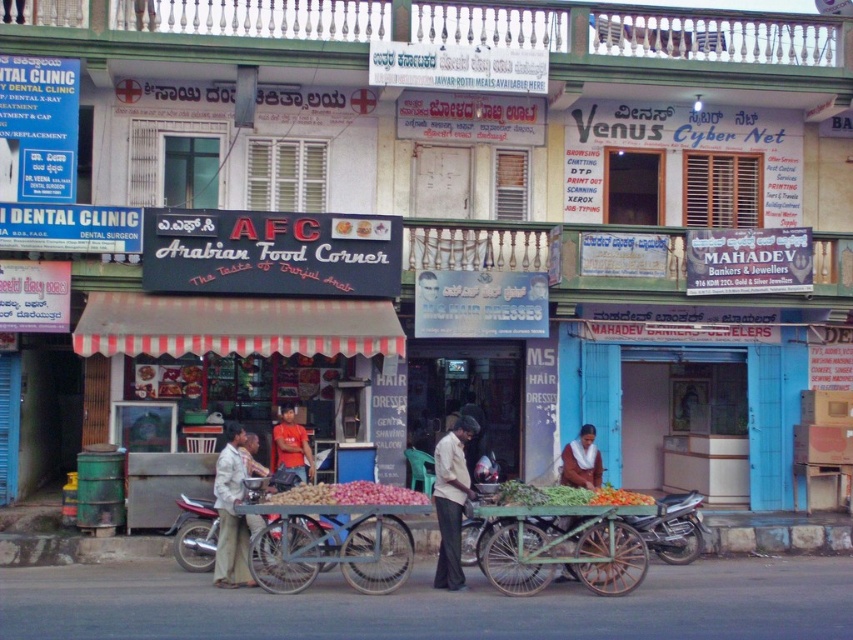
Question: Which is nearer to the pink matte onions at center?

Choices:
 (A) metallic cart at center
 (B) green wooden cart at center

Answer: (A)

Question: Does light beige fabric pants at center appear on the left side of matte orange shirt at center?

Choices:
 (A) no
 (B) yes

Answer: (B)

Question: Estimate the real-world distances between objects in this image. Which object is closer to the green leafy vegetables at center?

Choices:
 (A) matte orange shirt at center
 (B) green wooden cart at center
 (C) pink matte onions at center
 (D) dark grey trousers at center

Answer: (B)

Question: Does green wooden cart at center appear on the left side of pink matte onions at center?

Choices:
 (A) yes
 (B) no

Answer: (B)

Question: Which of the following is the closest to the observer?

Choices:
 (A) (227, 534)
 (B) (399, 502)
 (C) (352, 560)

Answer: (C)

Question: Is metallic cart at center positioned at the back of matte orange shirt at center?

Choices:
 (A) yes
 (B) no

Answer: (B)